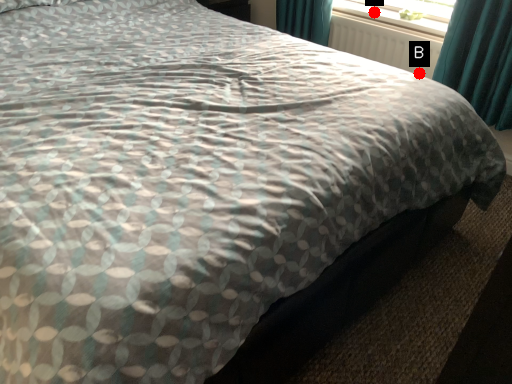
Question: Two points are circled on the image, labeled by A and B beside each circle. Which of the following is the closest to the observer?

Choices:
 (A) A is closer
 (B) B is closer

Answer: (B)